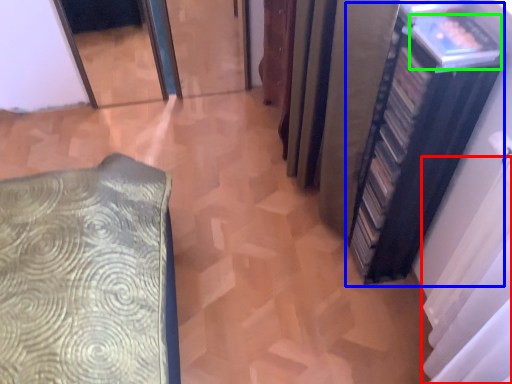
Question: Which is farther away from curtain (highlighted by a red box)? bookshelf (highlighted by a blue box) or book (highlighted by a green box)?

Choices:
 (A) bookshelf
 (B) book

Answer: (B)